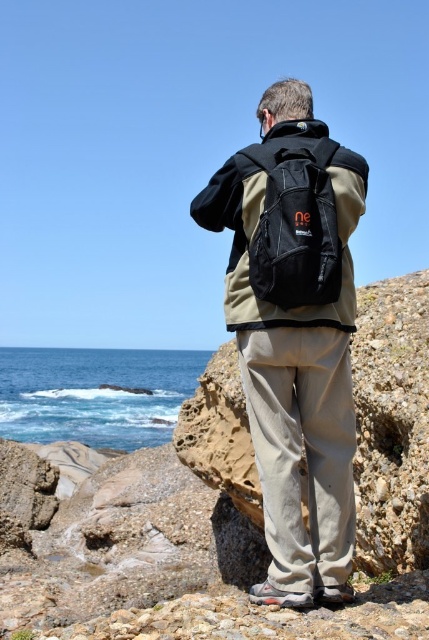
Question: Which point is closer to the camera?

Choices:
 (A) (299, 550)
 (B) (251, 252)
 (C) (175, 403)

Answer: (A)

Question: Does blue water at lower left come behind black fabric backpack at center?

Choices:
 (A) yes
 (B) no

Answer: (A)

Question: Which is farther from the blue water at lower left?

Choices:
 (A) black fabric backpack at center
 (B) black matte backpack at center

Answer: (A)

Question: Is blue water at lower left positioned behind black fabric backpack at center?

Choices:
 (A) no
 (B) yes

Answer: (B)

Question: Is black matte backpack at center below blue water at lower left?

Choices:
 (A) no
 (B) yes

Answer: (A)

Question: Which point is farther to the camera?

Choices:
 (A) blue water at lower left
 (B) black matte backpack at center

Answer: (A)